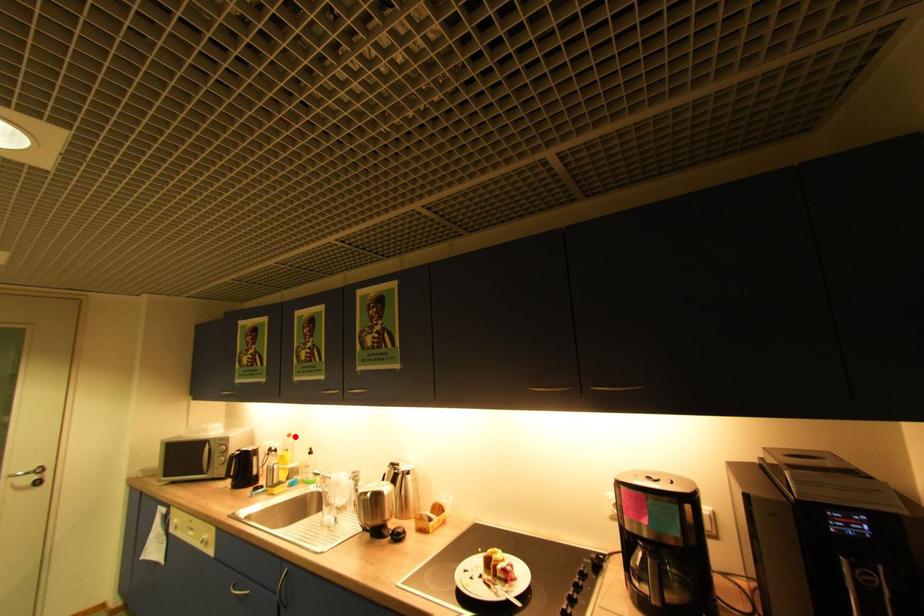
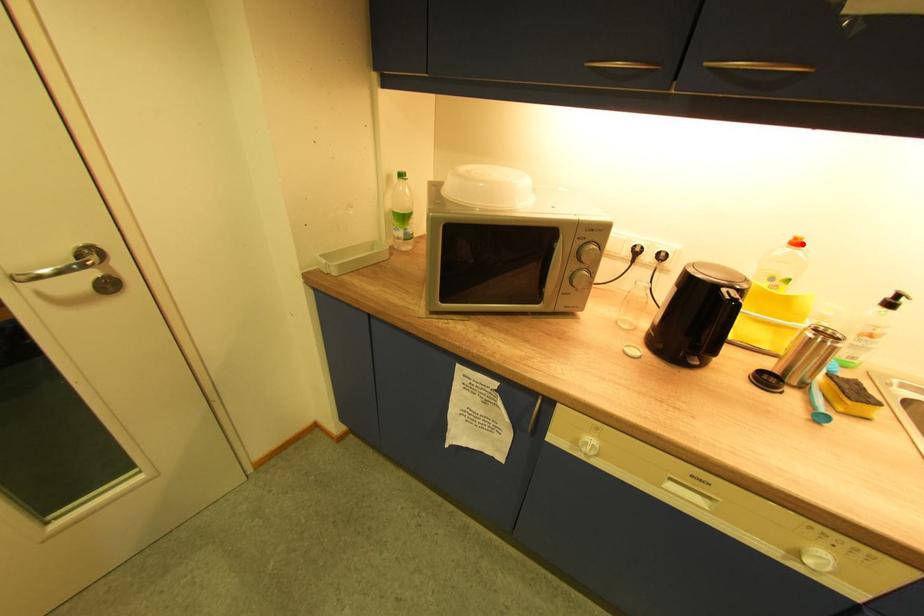
I am providing you with two images of the same scene from different viewpoints. A red point is marked on the first image and another point is marked on the second image. Is the red point in image1 aligned with the point shown in image2?

Yes